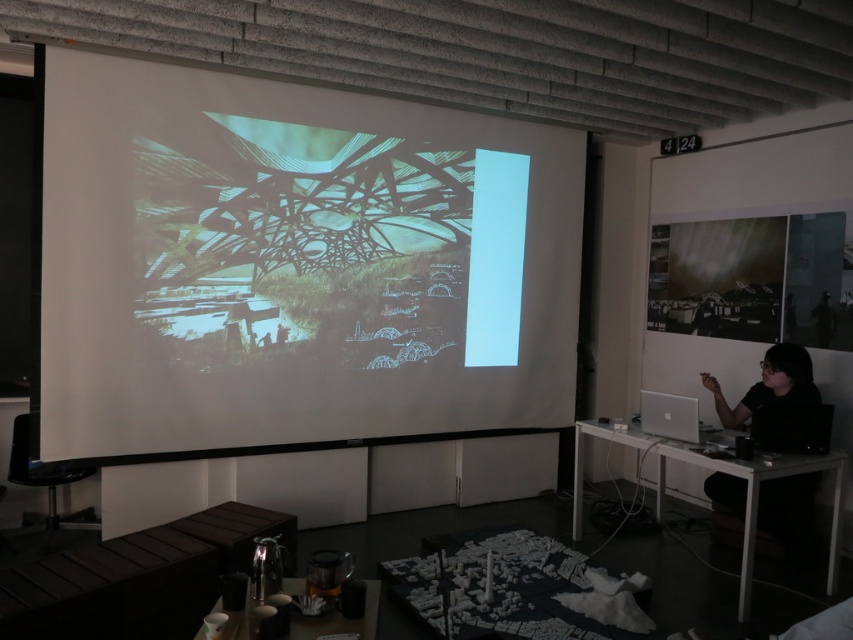
You are an attendee at the presentation. You notice the white matte projection screen at center and the black matte shirt at right. Which object is located above the other?

The white matte projection screen at center is positioned over the black matte shirt at right, meaning it is above the shirt.

You are an attendee at the presentation. You want to know if the white matte projection screen at center is wider than the black matte shirt at right. Can you confirm this?

The white matte projection screen at center is wider than the black matte shirt at right, so yes, the projection screen is wider than the shirt.

You are standing in a lecture hall and want to view the white matte projection screen at center clearly. Given that the recommended viewing distance for this screen is 10 feet, is your current position too close or too far?

The white matte projection screen at center and viewer are 11.20 feet apart, which is slightly farther than the recommended 10 feet. However, since the distance is only 1.2 feet beyond the recommendation, you should still be able to view the screen clearly from this position.